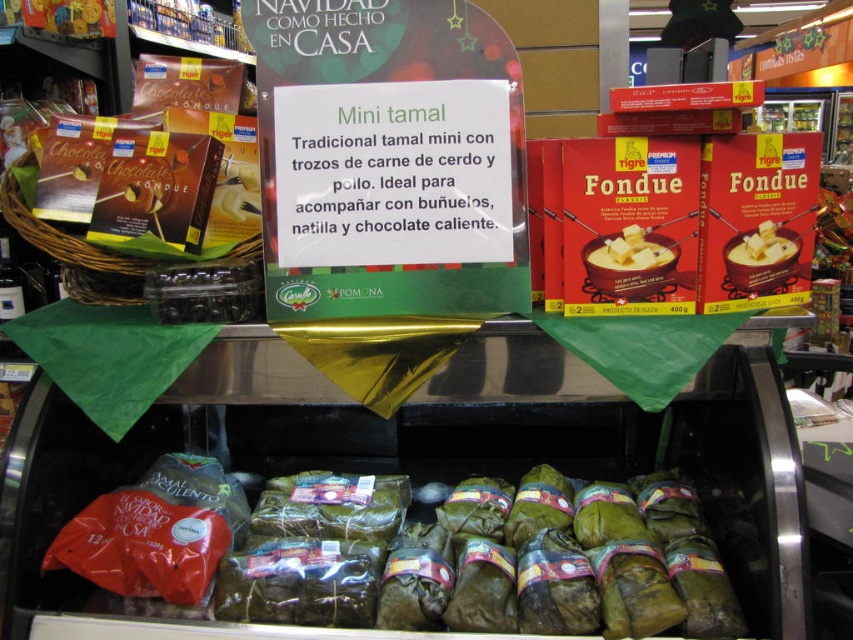
Question: Does white creamy cheese at center appear on the right side of smooth white cheese at center?

Choices:
 (A) no
 (B) yes

Answer: (A)

Question: Observing the image, what is the correct spatial positioning of green leafy wrapped at lower center in reference to smooth white cheese at center?

Choices:
 (A) below
 (B) above

Answer: (A)

Question: Which object is positioned farthest from the white creamy cheese at center?

Choices:
 (A) smooth white cheese at center
 (B) green leafy wrapped at lower center

Answer: (B)

Question: Which of the following is the closest to the observer?

Choices:
 (A) smooth white cheese at center
 (B) green leafy wrapped at lower center
 (C) white creamy cheese at center

Answer: (B)

Question: Does green leafy wrapped at lower center have a larger size compared to white creamy cheese at center?

Choices:
 (A) no
 (B) yes

Answer: (B)

Question: Which point appears farthest from the camera in this image?

Choices:
 (A) (749, 234)
 (B) (699, 531)
 (C) (639, 260)

Answer: (B)